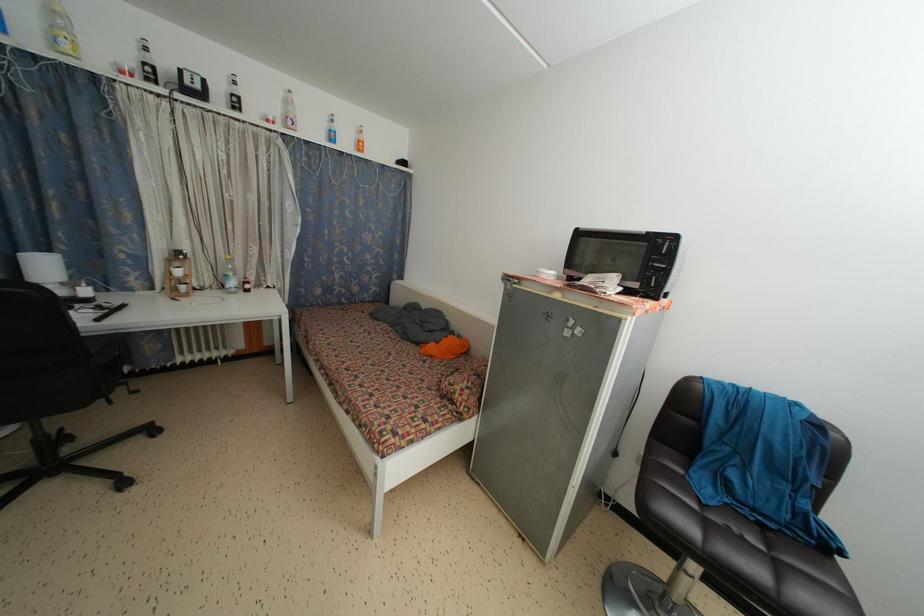
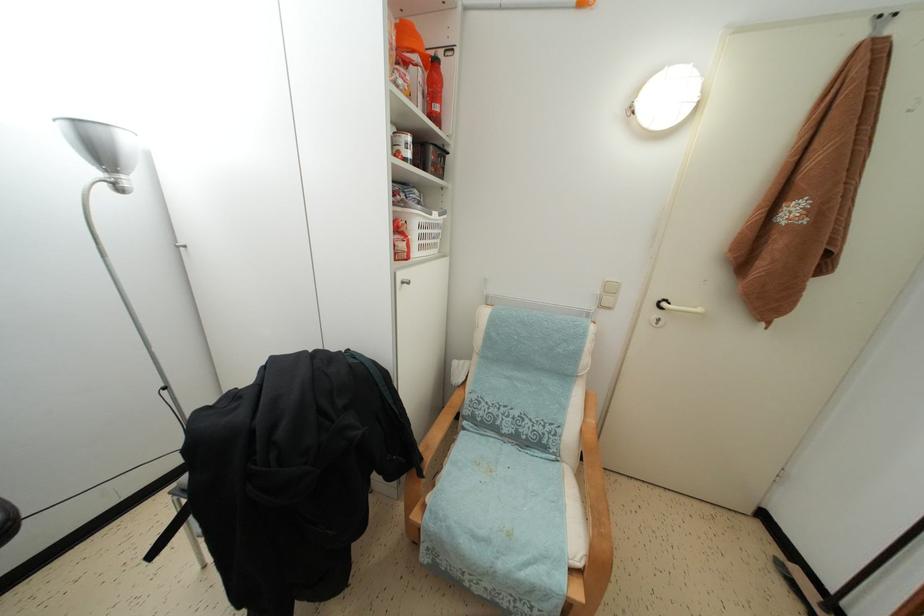
How did the camera likely rotate?

The camera's rotation is toward right-down.